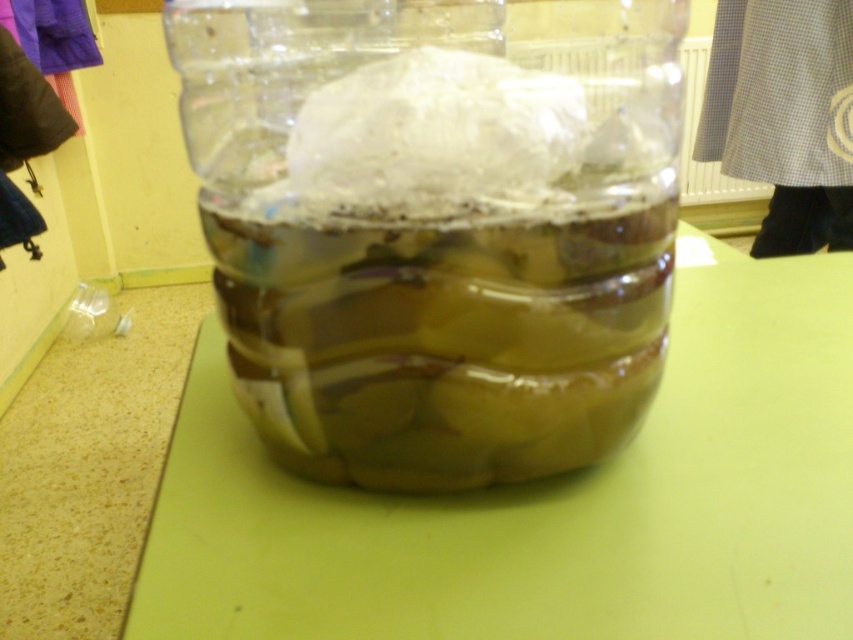
You are standing in a kitchen and want to place a small bowl on the surface between the transparent plastic jar at center and the green matte table at center. Which surface should you choose?

The transparent plastic jar at center is further to the viewer than the green matte table at center, so the surface between them is the green matte table at center. Place the bowl there.